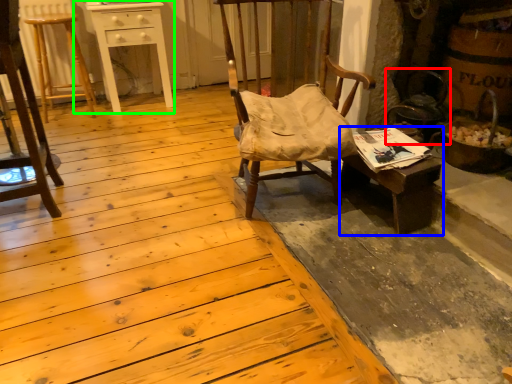
Question: Which is farther away from swivel chair (highlighted by a red box)? desk (highlighted by a blue box) or table (highlighted by a green box)?

Choices:
 (A) desk
 (B) table

Answer: (B)